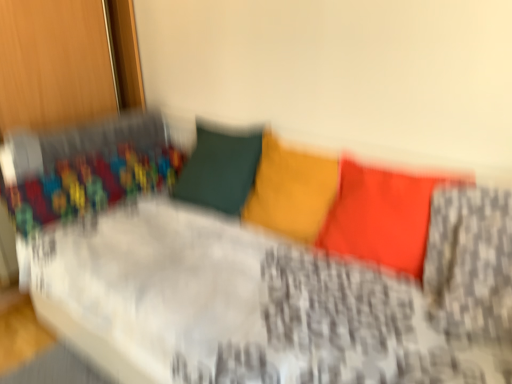
Question: Is matte orange pillow at center, which is counted as the 2th pillow, starting from the left, outside of matte yellow pillow at center, placed as the 1th pillow when sorted from left to right?

Choices:
 (A) no
 (B) yes

Answer: (B)

Question: From a real-world perspective, is matte orange pillow at center, which is counted as the 2th pillow, starting from the left, under matte yellow pillow at center, placed as the 1th pillow when sorted from left to right?

Choices:
 (A) no
 (B) yes

Answer: (A)

Question: From the image's perspective, is matte orange pillow at center, the 1th pillow viewed from the right, on top of matte yellow pillow at center, placed as the 1th pillow when sorted from left to right?

Choices:
 (A) yes
 (B) no

Answer: (B)

Question: Is matte orange pillow at center, the 1th pillow viewed from the right, positioned far away from matte yellow pillow at center, which ranks as the second pillow in right-to-left order?

Choices:
 (A) no
 (B) yes

Answer: (A)

Question: Can you confirm if matte orange pillow at center, the 1th pillow viewed from the right, is taller than matte yellow pillow at center, which ranks as the second pillow in right-to-left order?

Choices:
 (A) yes
 (B) no

Answer: (A)

Question: Could you tell me if matte orange pillow at center, which is counted as the 2th pillow, starting from the left, is turned towards matte yellow pillow at center, which ranks as the second pillow in right-to-left order?

Choices:
 (A) no
 (B) yes

Answer: (A)

Question: Is matte yellow pillow at center, placed as the 1th pillow when sorted from left to right, positioned with its back to matte orange pillow at center, the 1th pillow viewed from the right?

Choices:
 (A) yes
 (B) no

Answer: (B)

Question: Can you confirm if matte yellow pillow at center, placed as the 1th pillow when sorted from left to right, is shorter than matte orange pillow at center, the 1th pillow viewed from the right?

Choices:
 (A) no
 (B) yes

Answer: (B)

Question: Is matte yellow pillow at center, which ranks as the second pillow in right-to-left order, placed right next to matte orange pillow at center, the 1th pillow viewed from the right?

Choices:
 (A) yes
 (B) no

Answer: (B)

Question: Is matte yellow pillow at center, placed as the 1th pillow when sorted from left to right, aimed at matte orange pillow at center, which is counted as the 2th pillow, starting from the left?

Choices:
 (A) no
 (B) yes

Answer: (A)

Question: From a real-world perspective, is matte yellow pillow at center, which ranks as the second pillow in right-to-left order, located beneath matte orange pillow at center, the 1th pillow viewed from the right?

Choices:
 (A) yes
 (B) no

Answer: (A)

Question: Is matte yellow pillow at center, placed as the 1th pillow when sorted from left to right, not within matte orange pillow at center, the 1th pillow viewed from the right?

Choices:
 (A) no
 (B) yes

Answer: (B)

Question: Considering the positions of matte yellow pillow at center, which ranks as the second pillow in right-to-left order, and matte orange pillow at center, the 1th pillow viewed from the right, in the image, is matte yellow pillow at center, which ranks as the second pillow in right-to-left order, taller or shorter than matte orange pillow at center, the 1th pillow viewed from the right,?

Choices:
 (A) tall
 (B) short

Answer: (B)